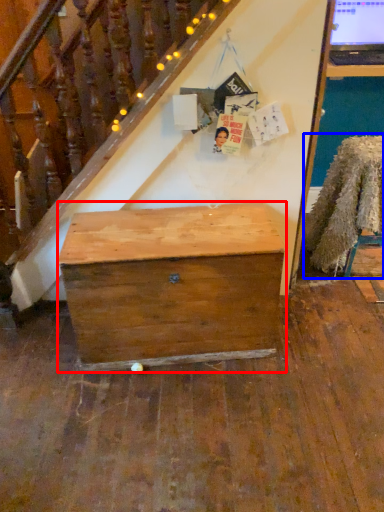
Question: Which object is closer to the camera taking this photo, desk (highlighted by a red box) or chair (highlighted by a blue box)?

Choices:
 (A) desk
 (B) chair

Answer: (A)